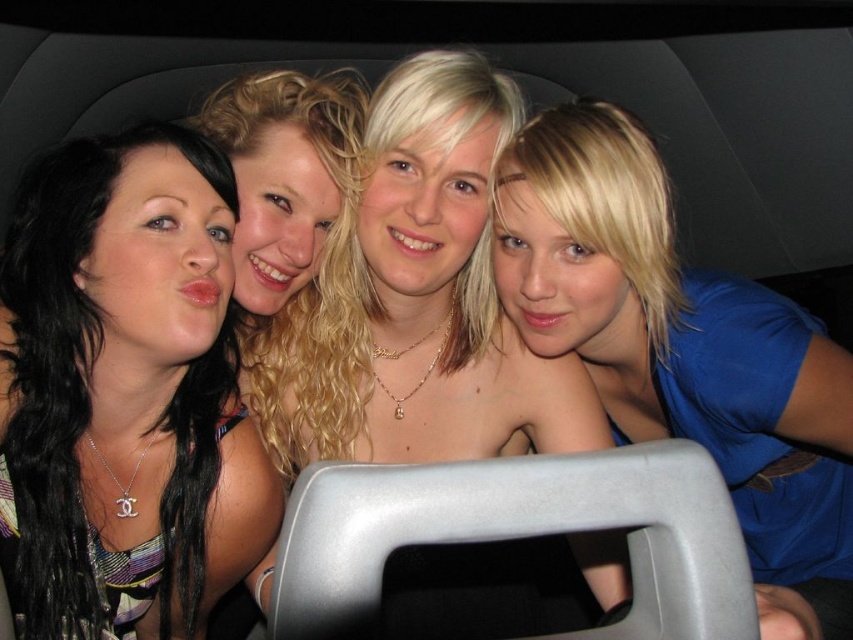
Question: Is matte black hair at left further to camera compared to blue matte shirt at upper right?

Choices:
 (A) no
 (B) yes

Answer: (A)

Question: Which point is closer to the camera?

Choices:
 (A) blue matte shirt at upper right
 (B) matte black hair at left

Answer: (B)

Question: Among these objects, which one is farthest from the camera?

Choices:
 (A) blue matte shirt at upper right
 (B) matte black hair at left

Answer: (A)

Question: In this image, where is matte black hair at left located relative to blue matte shirt at upper right?

Choices:
 (A) right
 (B) left

Answer: (B)

Question: From the image, what is the correct spatial relationship of matte black hair at left in relation to blue matte shirt at upper right?

Choices:
 (A) right
 (B) left

Answer: (B)